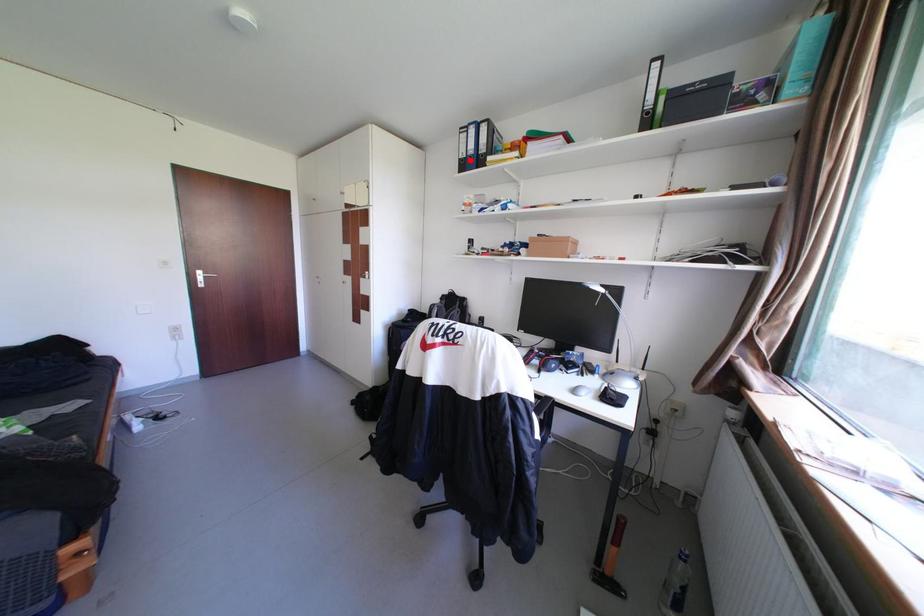
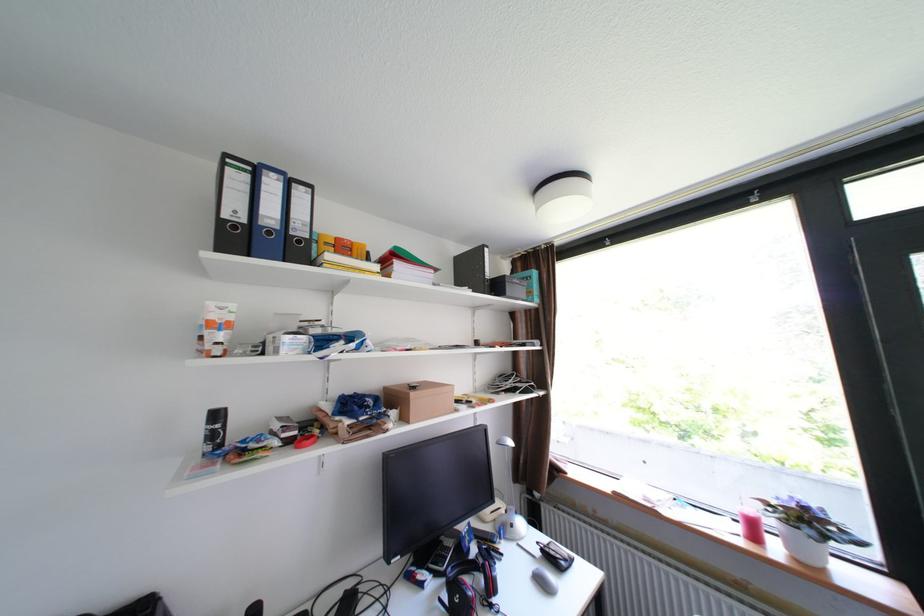
Question: A red point is marked in image1. In image2, is the corresponding 3D point closer to the camera or farther? Reply with the corresponding letter.

Choices:
 (A) The corresponding 3D point is closer.
 (B) The corresponding 3D point is farther.

Answer: (B)